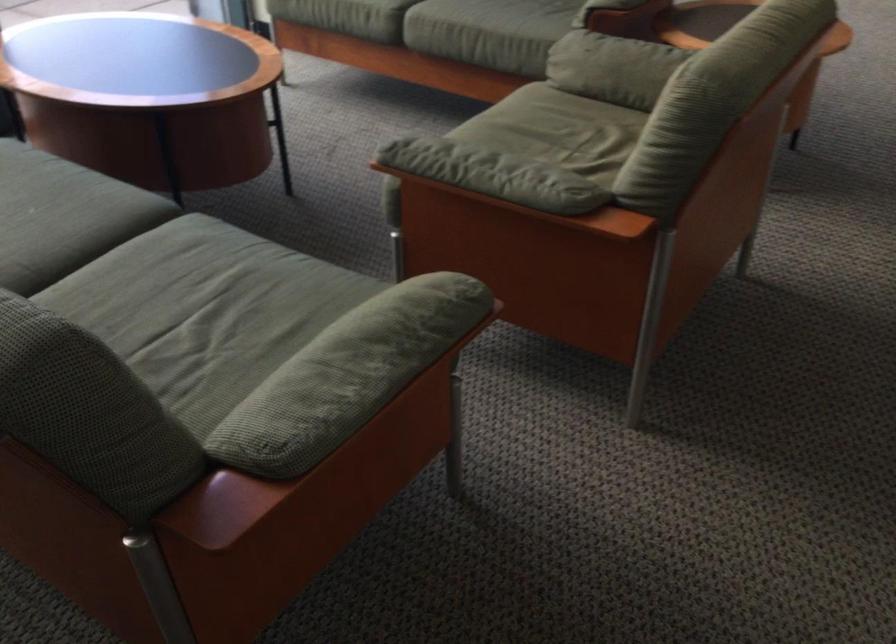
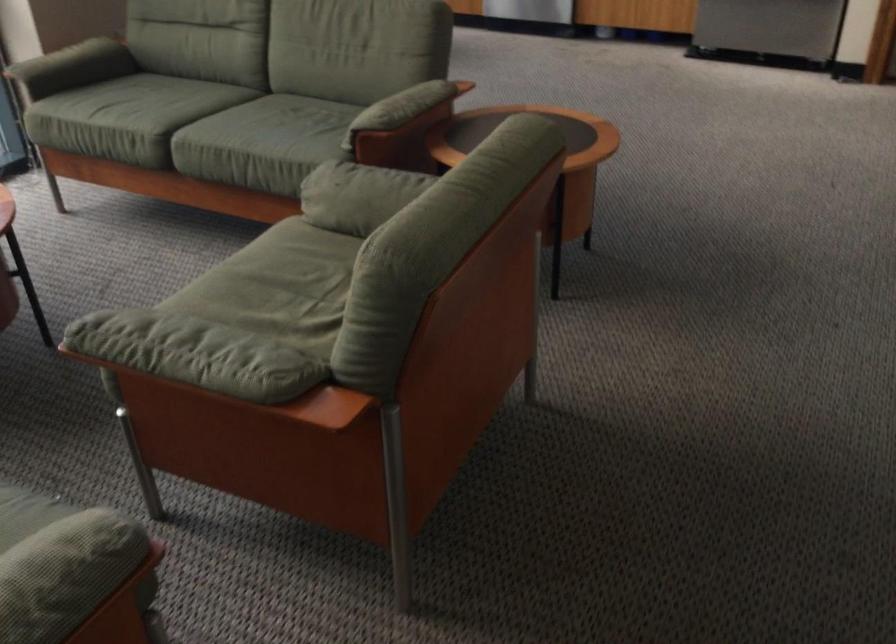
The point at (540, 118) is marked in the first image. Where is the corresponding point in the second image?

(289, 260)